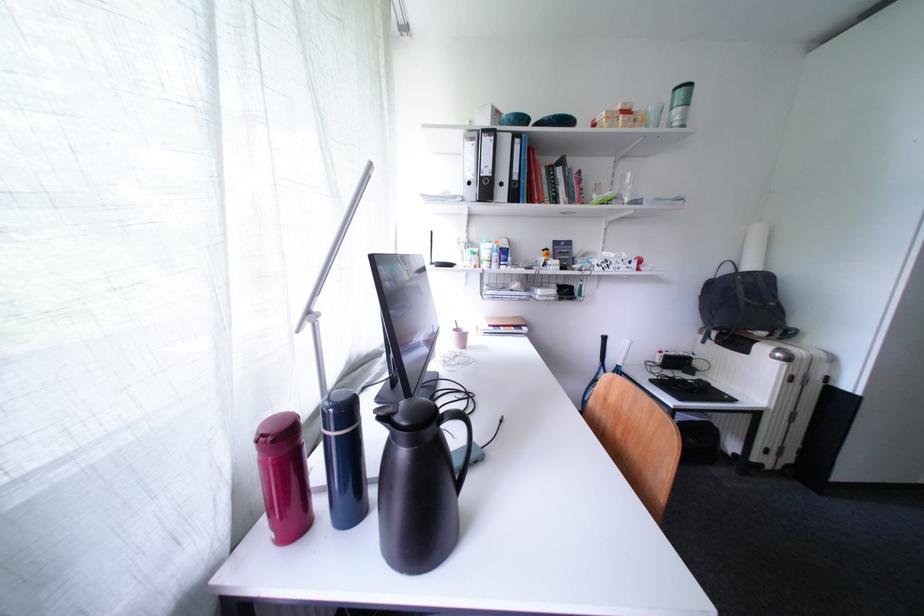
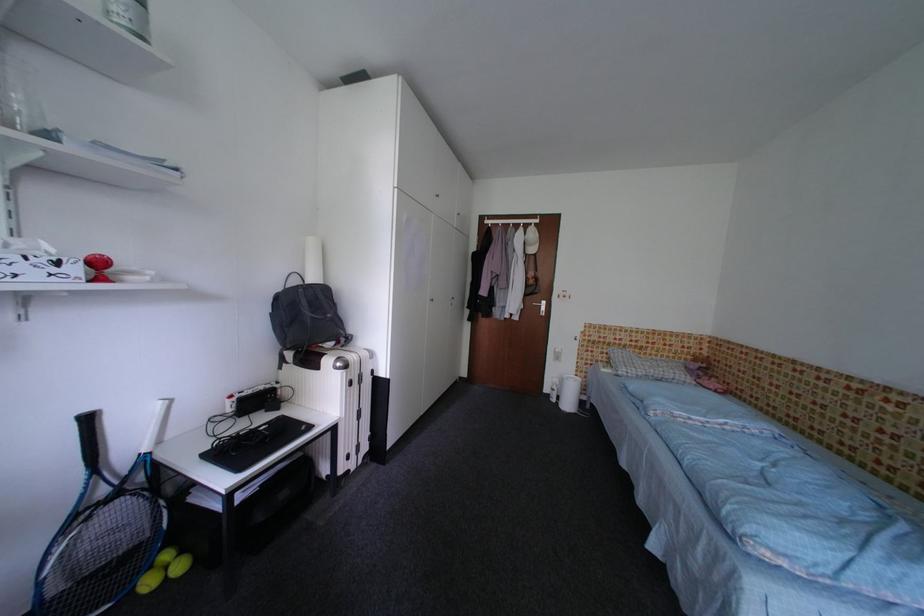
Locate, in the second image, the point that corresponds to (x=641, y=267) in the first image.

(83, 272)